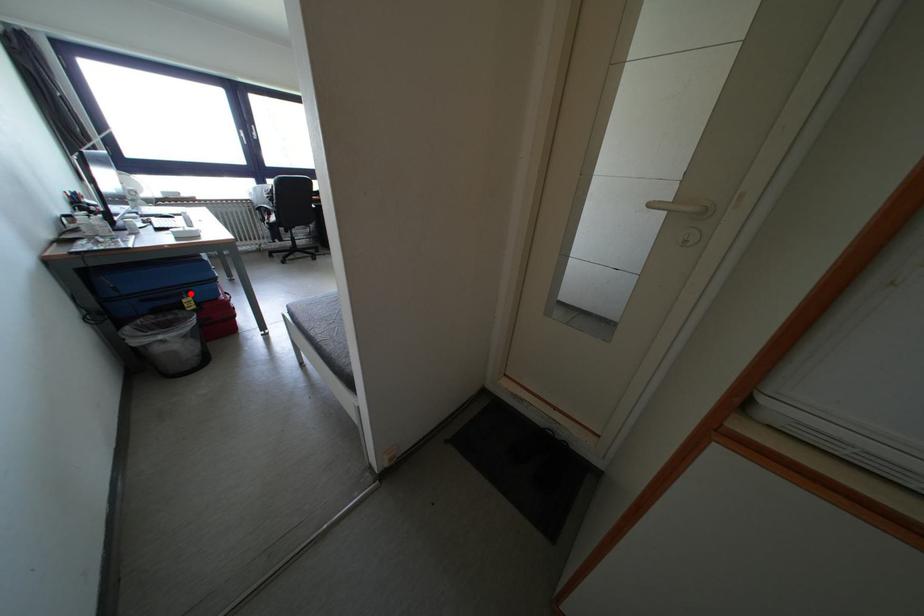
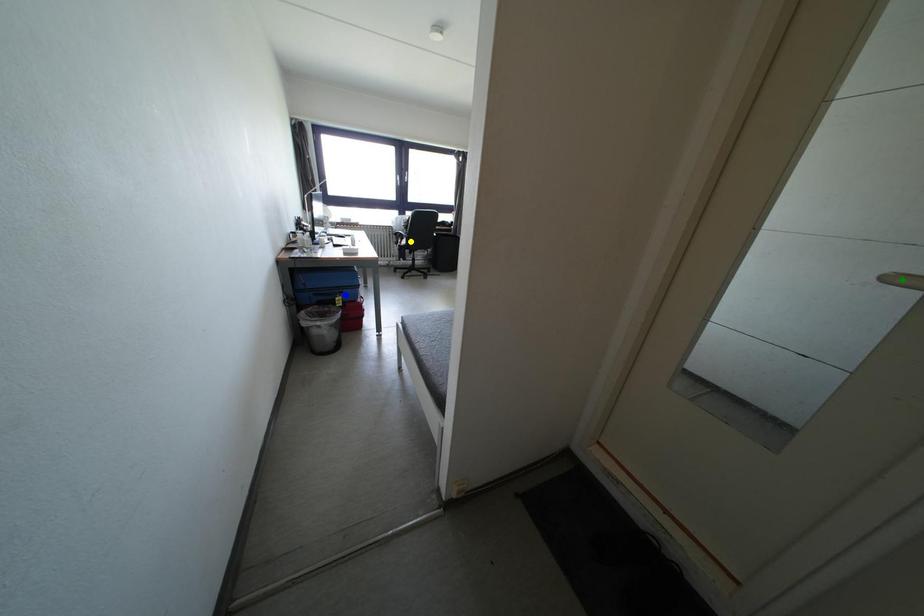
Question: I am providing you with two images of the same scene from different viewpoints. A red point is marked on the first image. You are given multiple points on the second image. Which spot in image 2 lines up with the point in image 1?

Choices:
 (A) yellow point
 (B) blue point
 (C) green point

Answer: (B)